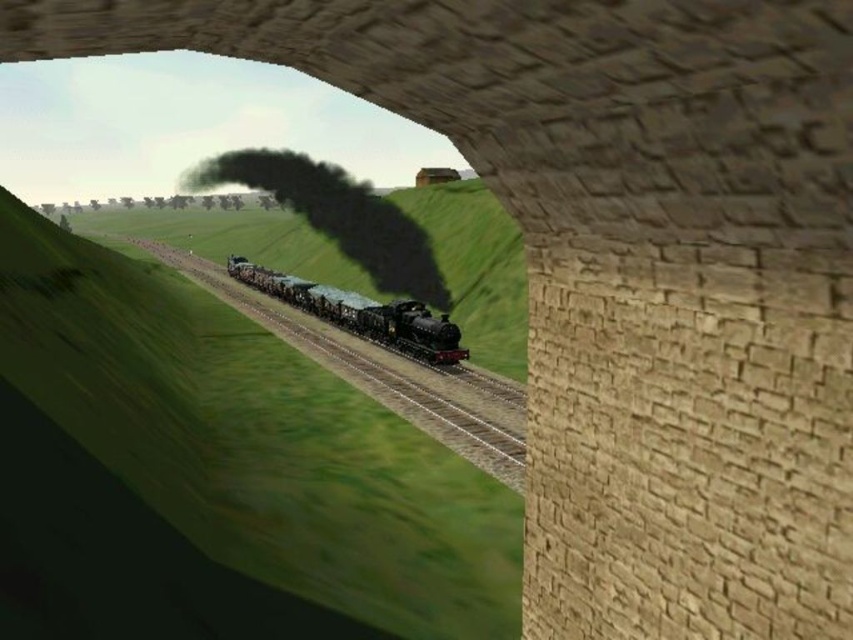
Question: Which point is closer to the camera taking this photo?

Choices:
 (A) (428, 346)
 (B) (309, 196)

Answer: (A)

Question: Is black matte steam at center below polished black locomotive at center?

Choices:
 (A) yes
 (B) no

Answer: (B)

Question: Is shiny black track at center below polished black locomotive at center?

Choices:
 (A) no
 (B) yes

Answer: (A)

Question: Among these objects, which one is farthest from the camera?

Choices:
 (A) black matte steam at center
 (B) shiny black track at center

Answer: (A)

Question: Which point is farther to the camera?

Choices:
 (A) (364, 264)
 (B) (318, 304)
 (C) (358, 337)

Answer: (A)

Question: Is shiny black track at center wider than polished black locomotive at center?

Choices:
 (A) yes
 (B) no

Answer: (A)